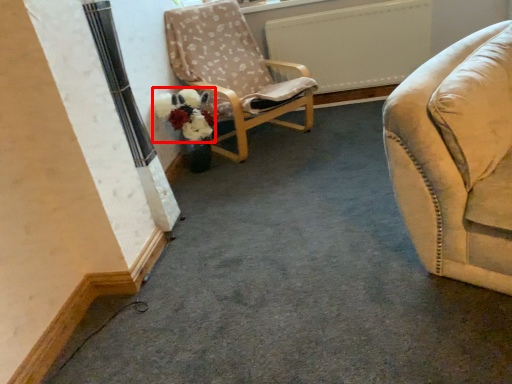
Question: From the image, what is the correct spatial relationship of flower (annotated by the red box) in relation to chair?

Choices:
 (A) right
 (B) left

Answer: (B)